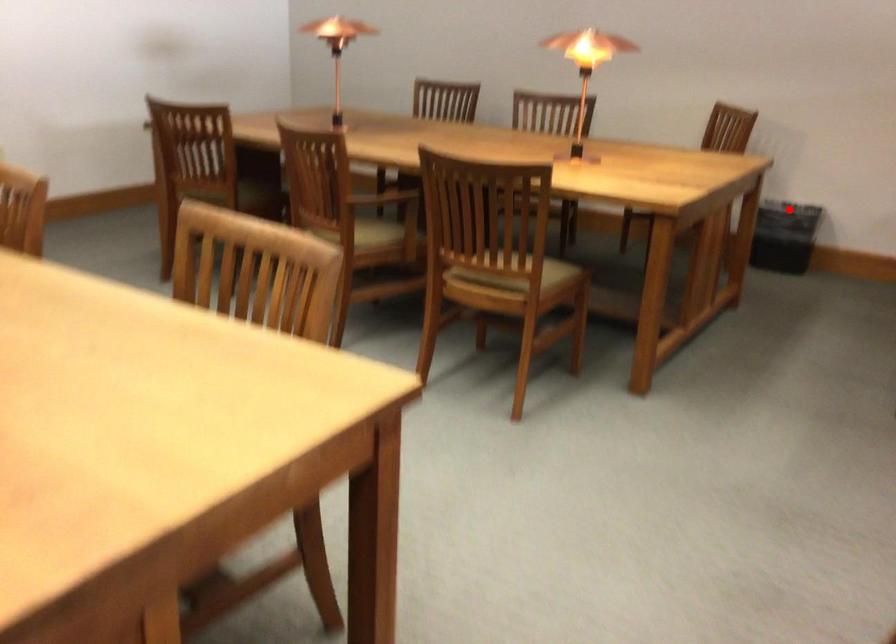
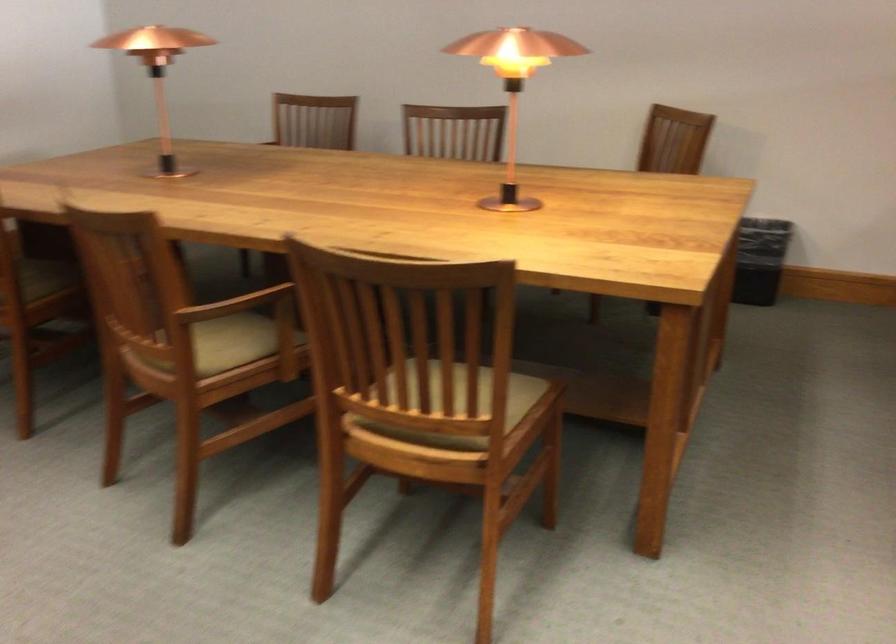
Find the pixel in the second image that matches the highlighted location in the first image.

(760, 260)